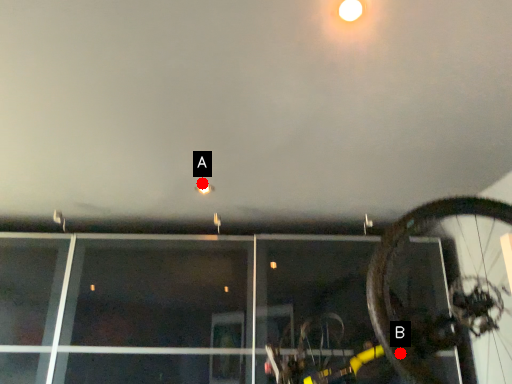
Question: Two points are circled on the image, labeled by A and B beside each circle. Which of the following is the farthest from the observer?

Choices:
 (A) A is further
 (B) B is further

Answer: (A)